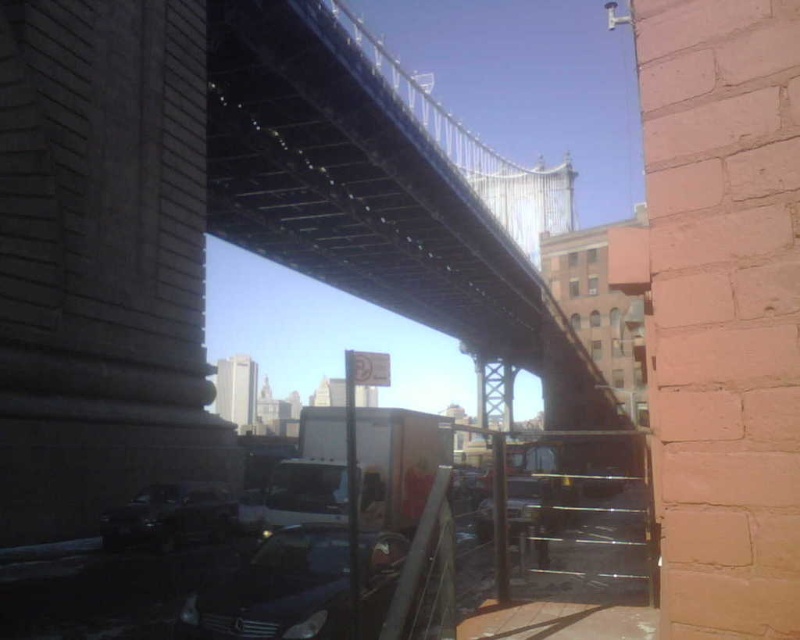
Question: Which point is farther to the camera?

Choices:
 (A) shiny black car at lower center
 (B) shiny black car at lower left

Answer: (B)

Question: Can you confirm if shiny black car at lower center is positioned to the left of metallic silver car at center?

Choices:
 (A) yes
 (B) no

Answer: (A)

Question: In this image, where is shiny black car at lower center located relative to shiny black car at lower left?

Choices:
 (A) right
 (B) left

Answer: (A)

Question: Which point is closer to the camera?

Choices:
 (A) metallic silver car at center
 (B) shiny black car at lower left
 (C) shiny black car at lower center

Answer: (C)

Question: From the image, what is the correct spatial relationship of shiny black car at lower left in relation to metallic silver car at center?

Choices:
 (A) right
 (B) left

Answer: (B)

Question: Among these objects, which one is farthest from the camera?

Choices:
 (A) metallic silver car at center
 (B) shiny black car at lower left
 (C) shiny black car at lower center

Answer: (B)